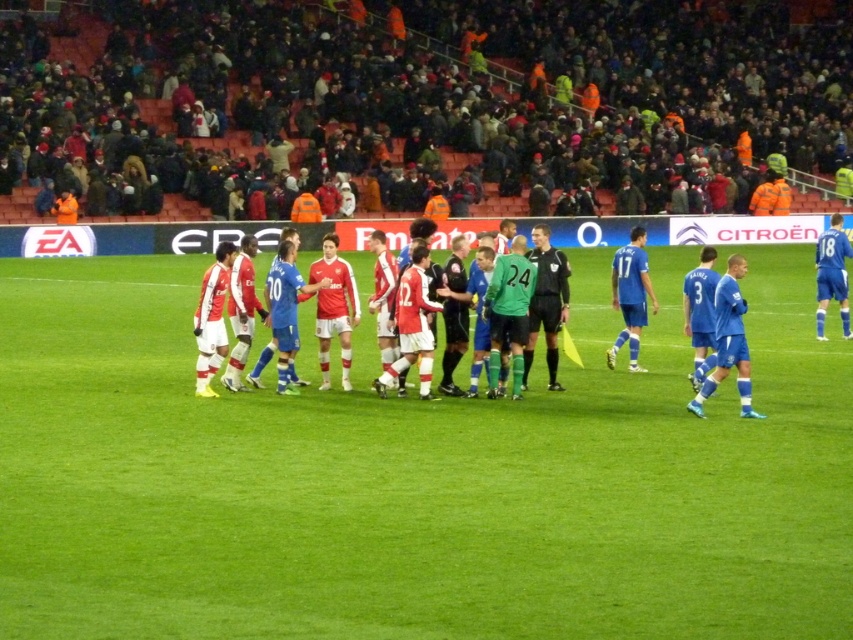
Question: Does matte red jersey at center appear on the left side of black jersey at center?

Choices:
 (A) yes
 (B) no

Answer: (B)

Question: Does green grass field at center appear under blue smooth jersey at right?

Choices:
 (A) yes
 (B) no

Answer: (A)

Question: Which point is farther to the camera?

Choices:
 (A) matte red jersey at center
 (B) black jersey at center

Answer: (B)

Question: Considering the real-world distances, which object is farthest from the green grass field at center?

Choices:
 (A) matte red jersey at center
 (B) blue smooth jersey at right
 (C) black jersey at center

Answer: (B)

Question: Which object appears farthest from the camera in this image?

Choices:
 (A) blue smooth jersey at right
 (B) matte red jersey at center

Answer: (A)

Question: Is green grass field at center closer to camera compared to black jersey at center?

Choices:
 (A) yes
 (B) no

Answer: (A)